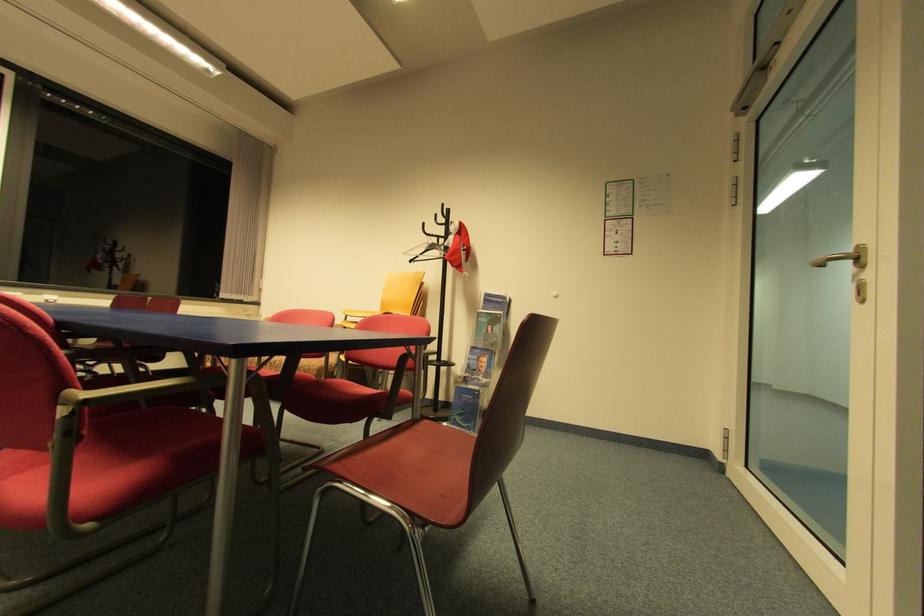
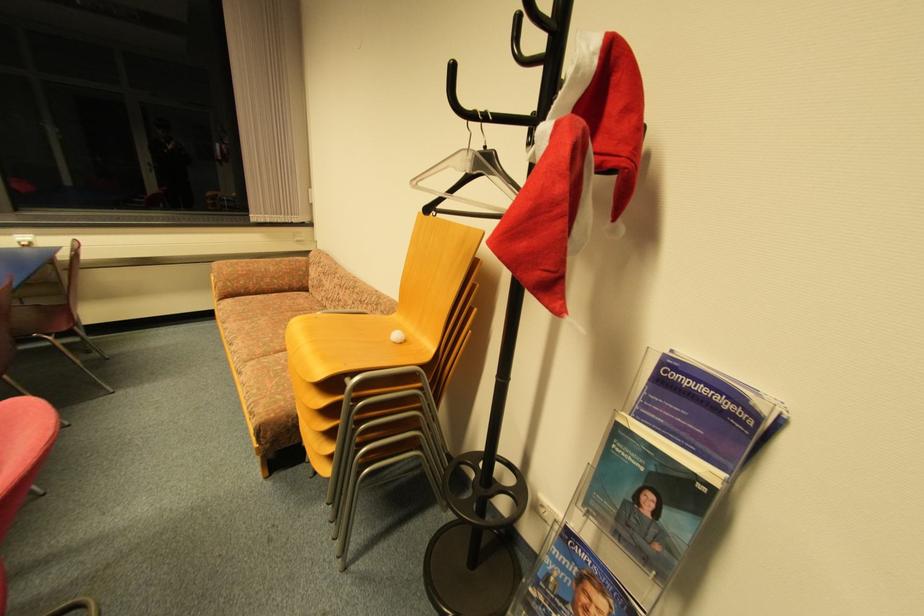
In the second image, find the point that corresponds to point (408, 254) in the first image.

(419, 184)